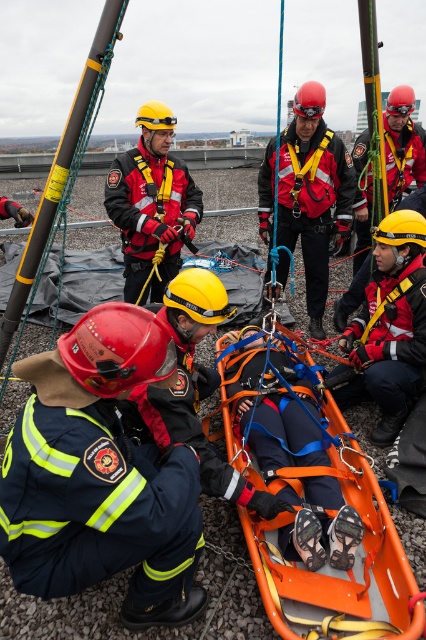
Question: Which of these objects is positioned closest to the red fabric helmet at lower left?

Choices:
 (A) orange plastic stretcher at center
 (B) matte black helmet at center

Answer: (A)

Question: Is red fabric helmet at lower left above orange plastic stretcher at center?

Choices:
 (A) yes
 (B) no

Answer: (A)

Question: Does red fabric helmet at lower left have a smaller size compared to orange plastic stretcher at center?

Choices:
 (A) yes
 (B) no

Answer: (A)

Question: Considering the real-world distances, which object is closest to the matte black helmet at center?

Choices:
 (A) red fabric helmet at lower left
 (B) orange plastic stretcher at center

Answer: (B)

Question: Estimate the real-world distances between objects in this image. Which object is farther from the orange fabric stretcher at center?

Choices:
 (A) matte black helmet at center
 (B) orange plastic stretcher at center
 (C) red fabric helmet at lower left

Answer: (C)

Question: Does red hard hat at center lie behind matte black helmet at center?

Choices:
 (A) yes
 (B) no

Answer: (A)